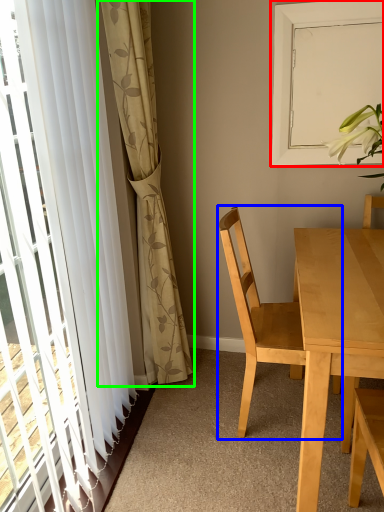
Question: Which object is positioned closest to window screen (highlighted by a red box)? Select from chair (highlighted by a blue box) and curtain (highlighted by a green box).

Choices:
 (A) chair
 (B) curtain

Answer: (A)